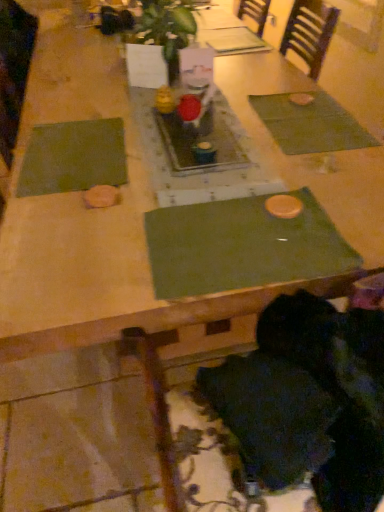
This screenshot has width=384, height=512. Identify the location of free space in front of green fabric place mat at left, which ranks as the 1th place mat in left-to-right order. (81, 219).